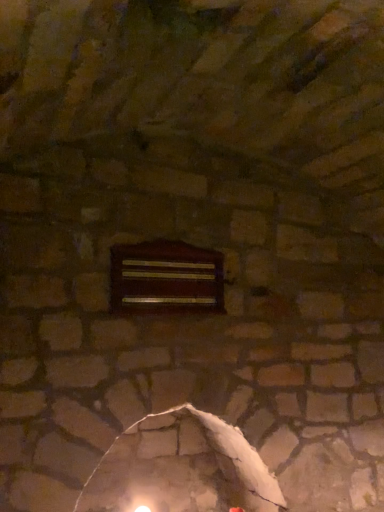
What is the approximate width of wooden window at center?

It is 1.70 inches.

Where is `wooden window at center`? This screenshot has height=512, width=384. wooden window at center is located at coordinates (165, 278).

What do you see at coordinates (165, 278) in the screenshot? The width and height of the screenshot is (384, 512). I see `wooden window at center` at bounding box center [165, 278].

The width and height of the screenshot is (384, 512). I want to click on wooden window at center, so point(165,278).